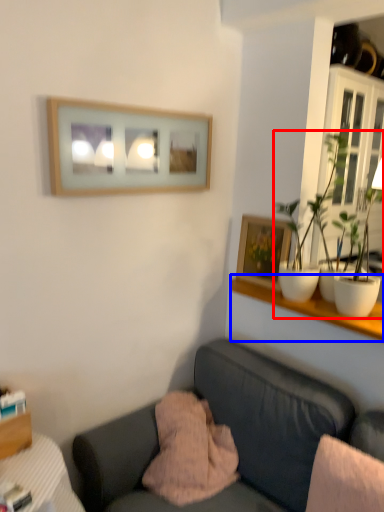
Question: Which object is further to the camera taking this photo, houseplant (highlighted by a red box) or shelf (highlighted by a blue box)?

Choices:
 (A) houseplant
 (B) shelf

Answer: (B)